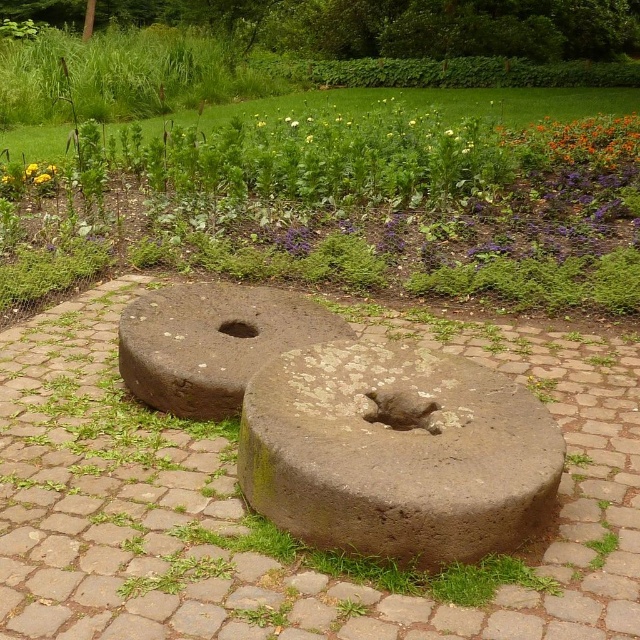
Looking at this image, you are a gardener standing on the cobblestone path and want to place a new decorative bird sculpture exactly between the brown stone millstones at center and the brown stone hole at center. Which direction should you move from the millstones to reach the midpoint?

The brown stone millstones at center is to the right of brown stone hole at center, so to reach the midpoint between them, move left from the millstones.

You are standing in the garden and want to place a 3 meter long wooden bench between you and the brown stone millstones at center. Is there enough space for the bench?

The distance between you and the brown stone millstones at center is 2.50 meters. Since the bench is 3 meters long, it would not fit in the available space.

You are a gardener who needs to water the flowers in the flower bed. You are standing at the edge of the cobblestone path and see the brown stone millstones at center and the green mossy stone at center. Which stone should you move first to access the flower bed?

The brown stone millstones at center is in front of the green mossy stone at center, so you should move the brown stone millstones at center first to access the flower bed.